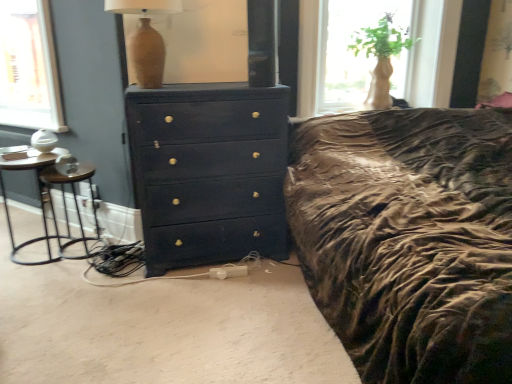
The width and height of the screenshot is (512, 384). In order to click on matte dark blue dresser at center in this screenshot , I will do `click(209, 172)`.

Find the location of a particular element. metallic silver side table at left is located at coordinates (53, 204).

Measure the distance between metallic silver side table at left and camera.

A distance of 2.14 meters exists between metallic silver side table at left and camera.

Locate an element on the screen. translucent glass vase at upper right is located at coordinates (375, 51).

From the image's perspective, between matte beige vase at upper center and matte dark blue dresser at center, who is located below?

From the image's view, matte dark blue dresser at center is below.

Which is more to the left, matte beige vase at upper center or matte dark blue dresser at center?

matte beige vase at upper center.

Is matte beige vase at upper center facing towards matte dark blue dresser at center?

No, matte beige vase at upper center is not turned towards matte dark blue dresser at center.

Between matte beige vase at upper center and matte dark blue dresser at center, which one is positioned behind?

matte dark blue dresser at center is behind.

Is matte dark blue dresser at center to the left or to the right of translucent glass vase at upper right in the image?

Based on their positions, matte dark blue dresser at center is located to the left of translucent glass vase at upper right.

Based on the photo, is translucent glass vase at upper right completely or partially inside matte dark blue dresser at center?

Actually, translucent glass vase at upper right is outside matte dark blue dresser at center.

From the image's perspective, does matte dark blue dresser at center appear lower than translucent glass vase at upper right?

Yes, from the image's perspective, matte dark blue dresser at center is beneath translucent glass vase at upper right.

Could you tell me if matte dark blue dresser at center is turned towards matte beige vase at upper center?

No, matte dark blue dresser at center is not oriented towards matte beige vase at upper center.

From a real-world perspective, is matte dark blue dresser at center located higher than matte beige vase at upper center?

No, from a real-world perspective, matte dark blue dresser at center is not above matte beige vase at upper center.

Which object is closer to the camera taking this photo, matte dark blue dresser at center or matte beige vase at upper center?

matte beige vase at upper center.

From the image's perspective, which one is positioned lower, matte dark blue dresser at center or matte beige vase at upper center?

matte dark blue dresser at center is shown below in the image.

Considering the sizes of objects black metal bar stool at left and matte dark blue dresser at center in the image provided, who is smaller, black metal bar stool at left or matte dark blue dresser at center?

black metal bar stool at left is smaller.

Could you tell me if black metal bar stool at left is facing matte dark blue dresser at center?

No, black metal bar stool at left is not turned towards matte dark blue dresser at center.

How far apart are black metal bar stool at left and matte dark blue dresser at center?

89.94 centimeters.

Considering the positions of objects black metal bar stool at left and matte dark blue dresser at center in the image provided, who is behind, black metal bar stool at left or matte dark blue dresser at center?

black metal bar stool at left is more distant.

Would you say black metal bar stool at left is inside or outside metallic silver side table at left?

black metal bar stool at left is contained in metallic silver side table at left.

Is black metal bar stool at left aimed at metallic silver side table at left?

No.

How many degrees apart are the facing directions of black metal bar stool at left and metallic silver side table at left?

The angular difference between black metal bar stool at left and metallic silver side table at left is 1.83e-05 degrees.

Where is `bar stool below the metallic silver side table at left (from a real-world perspective)`? This screenshot has height=384, width=512. bar stool below the metallic silver side table at left (from a real-world perspective) is located at coordinates (75, 206).

Is metallic silver side table at left facing away from matte beige vase at upper center?

That's not correct — metallic silver side table at left is not looking away from matte beige vase at upper center.

Can you confirm if metallic silver side table at left is shorter than matte beige vase at upper center?

Incorrect, the height of metallic silver side table at left does not fall short of that of matte beige vase at upper center.

Is metallic silver side table at left further to camera compared to matte beige vase at upper center?

That is True.

Locate an element on the screen. nightstand in front of the black metal bar stool at left is located at coordinates click(x=53, y=204).

Between metallic silver side table at left and black metal bar stool at left, which one has more height?

metallic silver side table at left.

Considering the positions of point (62, 152) and point (48, 168), is point (62, 152) closer or farther from the camera than point (48, 168)?

Clearly, point (62, 152) is more distant from the camera than point (48, 168).

Could you tell me if metallic silver side table at left is turned towards black metal bar stool at left?

No, metallic silver side table at left is not aimed at black metal bar stool at left.

Find the location of a particular element. The image size is (512, 384). the chest of drawers lying behind the matte beige vase at upper center is located at coordinates (209, 172).

Find the location of a particular element. This screenshot has width=512, height=384. chest of drawers on the left of translucent glass vase at upper right is located at coordinates (209, 172).

Considering their positions, is matte beige vase at upper center positioned further to black metal bar stool at left than matte dark blue dresser at center?

Based on the image, matte beige vase at upper center appears to be further to black metal bar stool at left.

From the image, which object appears to be nearer to translucent glass vase at upper right, metallic silver side table at left or matte beige vase at upper center?

Based on the image, matte beige vase at upper center appears to be nearer to translucent glass vase at upper right.

Considering their positions, is matte beige vase at upper center positioned further to translucent glass vase at upper right than black metal bar stool at left?

Based on the image, black metal bar stool at left appears to be further to translucent glass vase at upper right.

Based on their spatial positions, is metallic silver side table at left or matte beige vase at upper center further from black metal bar stool at left?

Among the two, matte beige vase at upper center is located further to black metal bar stool at left.

Which object lies further to the anchor point metallic silver side table at left, black metal bar stool at left or translucent glass vase at upper right?

translucent glass vase at upper right is further to metallic silver side table at left.

From the image, which object appears to be farther from matte beige vase at upper center, translucent glass vase at upper right or black metal bar stool at left?

translucent glass vase at upper right lies further to matte beige vase at upper center than the other object.

Estimate the real-world distances between objects in this image. Which object is further from matte dark blue dresser at center, metallic silver side table at left or matte beige vase at upper center?

metallic silver side table at left is positioned further to the anchor matte dark blue dresser at center.

In the scene shown: Based on their spatial positions, is matte beige vase at upper center or black metal bar stool at left closer to matte dark blue dresser at center?

matte beige vase at upper center is positioned closer to the anchor matte dark blue dresser at center.

Image resolution: width=512 pixels, height=384 pixels. I want to click on chest of drawers between matte beige vase at upper center and black metal bar stool at left from top to bottom, so click(209, 172).

Locate an element on the screen. This screenshot has height=384, width=512. bar stool between metallic silver side table at left and matte dark blue dresser at center from left to right is located at coordinates (75, 206).

Where is `chest of drawers between metallic silver side table at left and translucent glass vase at upper right from left to right`? The image size is (512, 384). chest of drawers between metallic silver side table at left and translucent glass vase at upper right from left to right is located at coordinates (209, 172).

Where is `bar stool situated between metallic silver side table at left and translucent glass vase at upper right from left to right`? The image size is (512, 384). bar stool situated between metallic silver side table at left and translucent glass vase at upper right from left to right is located at coordinates (75, 206).